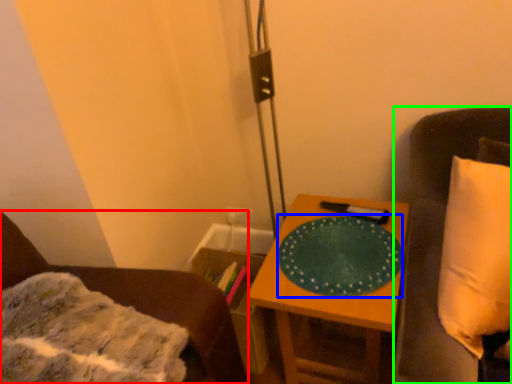
Question: Which object is positioned closest to furniture (highlighted by a red box)? Select from platter (highlighted by a blue box) and furniture (highlighted by a green box).

Choices:
 (A) platter
 (B) furniture

Answer: (A)